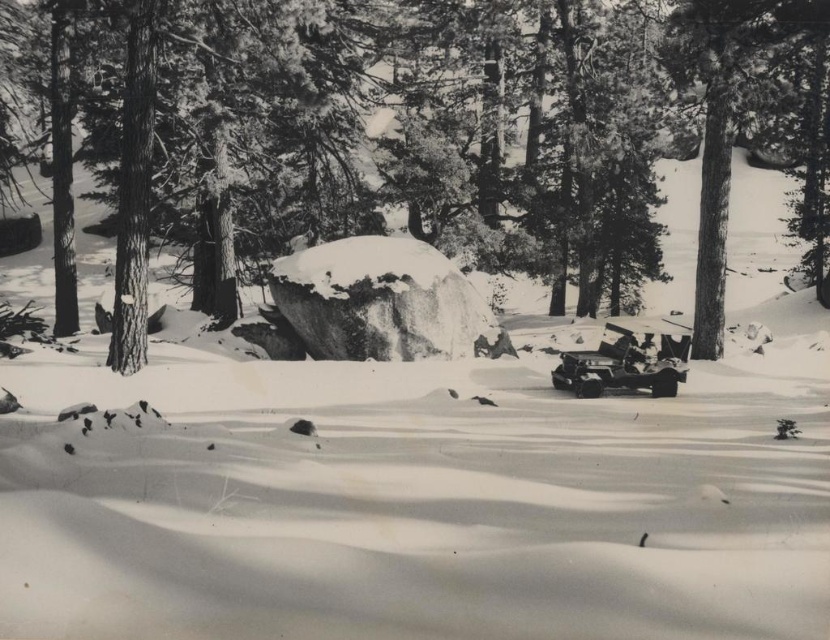
Does smooth bark tree at center have a lesser height compared to metallic silver car at lower right?

No, smooth bark tree at center is not shorter than metallic silver car at lower right.

Does smooth bark tree at center appear on the left side of metallic silver car at lower right?

In fact, smooth bark tree at center is to the right of metallic silver car at lower right.

From the picture: Who is more distant from viewer, [333,92] or [584,352]?

The point [333,92] is behind.

What are the coordinates of `smooth bark tree at center` in the screenshot? It's located at (453, 129).

Between smooth bark tree at center and snow-covered rock at center, which one appears on the left side from the viewer's perspective?

From the viewer's perspective, snow-covered rock at center appears more on the left side.

Does smooth bark tree at center have a lesser width compared to snow-covered rock at center?

In fact, smooth bark tree at center might be wider than snow-covered rock at center.

This screenshot has width=830, height=640. I want to click on smooth bark tree at center, so click(x=453, y=129).

Where is `smooth bark tree at center`? smooth bark tree at center is located at coordinates (453, 129).

Can you confirm if snow-covered rock at center is positioned below metallic silver car at lower right?

No.

Is snow-covered rock at center positioned before metallic silver car at lower right?

No, snow-covered rock at center is further to the viewer.

In order to click on snow-covered rock at center in this screenshot , I will do (x=379, y=300).